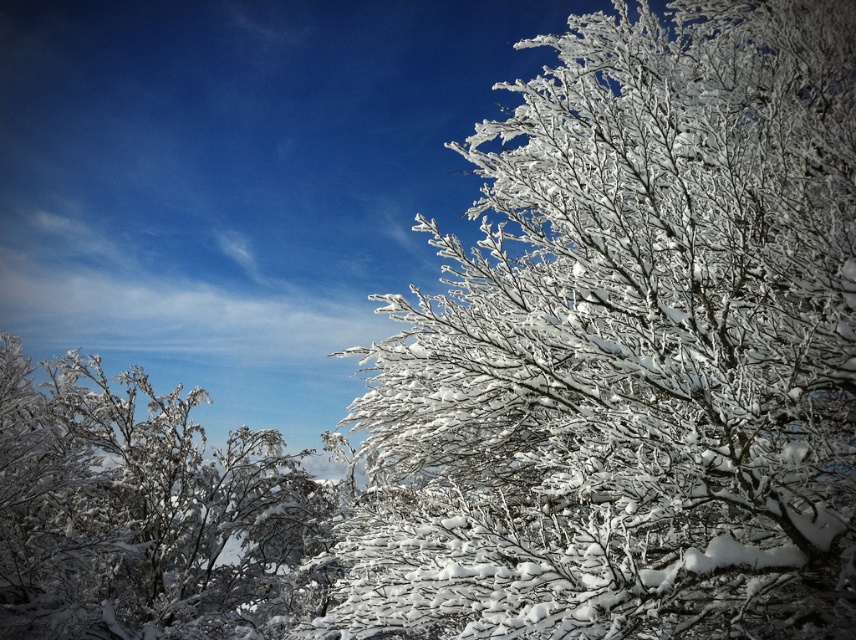
You are standing in the winter landscape and want to walk from the point at coordinates point (563, 224) to the point at coordinates point (15, 534). Which direction should you move to get closer to your destination?

Since point (563, 224) is in front of point (15, 534), you should move backward to reach your destination.